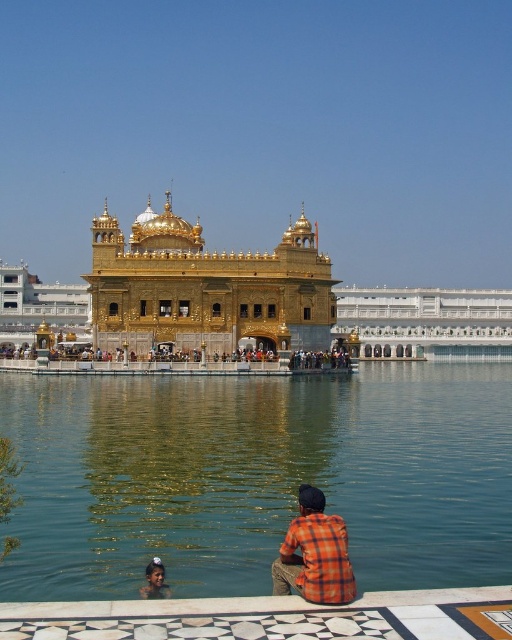
Does clear blue water at center have a smaller size compared to gold/golden dome at center?

Correct, clear blue water at center occupies less space than gold/golden dome at center.

Locate an element on the screen. Image resolution: width=512 pixels, height=640 pixels. clear blue water at center is located at coordinates 258,477.

Identify the location of clear blue water at center. This screenshot has width=512, height=640. (258, 477).

I want to click on clear blue water at center, so click(258, 477).

Who is higher up, clear blue water at center or orange checkered shirt at lower center?

clear blue water at center

Does point (45, 438) come closer to viewer compared to point (146, 570)?

No, it is behind (146, 570).

Where is `clear blue water at center`? The image size is (512, 640). clear blue water at center is located at coordinates (258, 477).

Which of these two, gold/golden dome at center or orange checkered shirt at lower center, stands shorter?

With less height is orange checkered shirt at lower center.

Is point (152, 292) closer to viewer compared to point (155, 593)?

No, (152, 292) is behind (155, 593).

Between point (152, 241) and point (162, 586), which one is positioned in front?

Point (162, 586) is in front.

Image resolution: width=512 pixels, height=640 pixels. I want to click on gold/golden dome at center, so click(x=205, y=288).